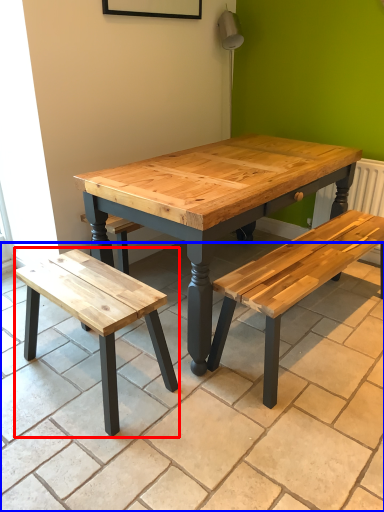
Question: Which object is further to the camera taking this photo, bench (highlighted by a red box) or tile (highlighted by a blue box)?

Choices:
 (A) bench
 (B) tile

Answer: (A)